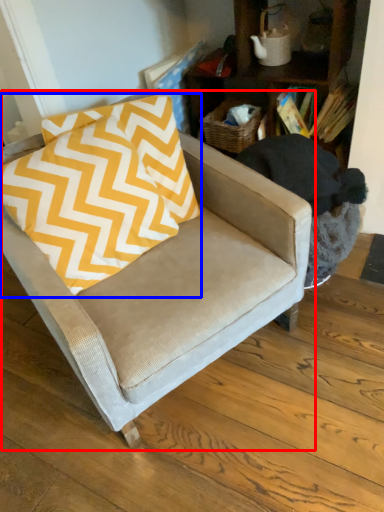
Question: Which object is closer to the camera taking this photo, chair (highlighted by a red box) or pillow (highlighted by a blue box)?

Choices:
 (A) chair
 (B) pillow

Answer: (A)